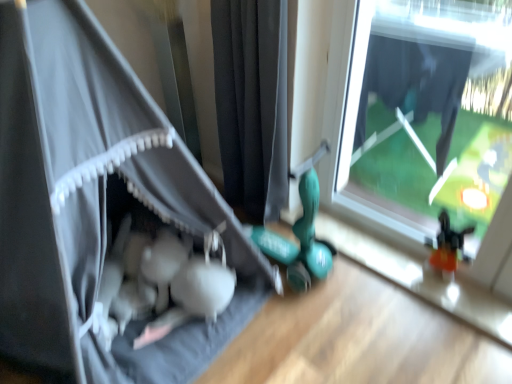
Question: Considering the positions of transparent glass window at center and black fabric curtain at center, which is counted as the 1th curtain, starting from the right, in the image, is transparent glass window at center taller or shorter than black fabric curtain at center, which is counted as the 1th curtain, starting from the right,?

Choices:
 (A) short
 (B) tall

Answer: (A)

Question: Considering their positions, is transparent glass window at center located in front of or behind black fabric curtain at center, which appears as the second curtain when viewed from the left?

Choices:
 (A) front
 (B) behind

Answer: (A)

Question: Estimate the real-world distances between objects in this image. Which object is closer to the matte gray tent at left, marked as the 2th curtain in a right-to-left arrangement?

Choices:
 (A) transparent glass window at center
 (B) black fabric curtain at center, which is counted as the 1th curtain, starting from the right

Answer: (B)

Question: Considering the real-world distances, which object is closest to the black fabric curtain at center, which is counted as the 1th curtain, starting from the right?

Choices:
 (A) transparent glass window at center
 (B) matte gray tent at left, acting as the 1th curtain starting from the left

Answer: (B)